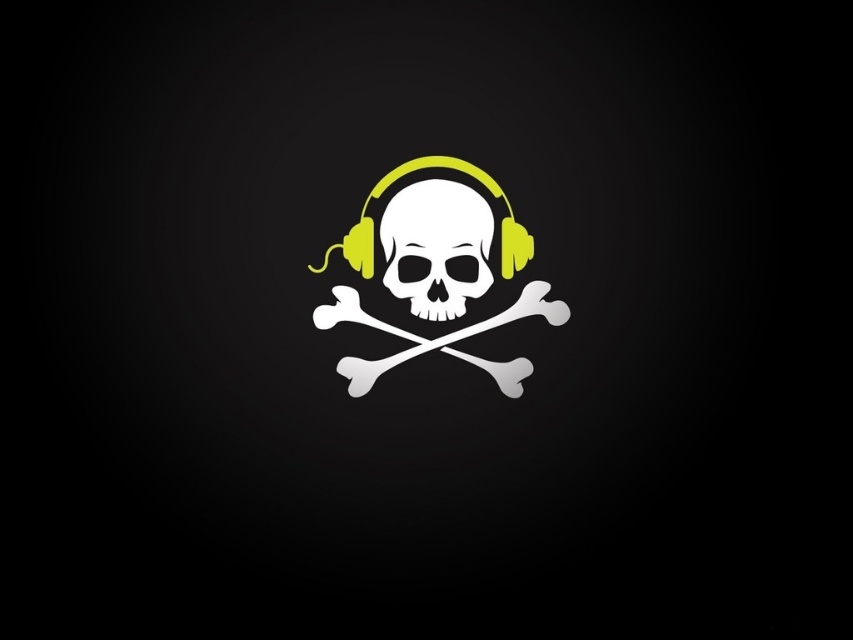
You are an artist working on a minimalist design featuring a skull and crossbones. You need to place a small sticker exactly at the coordinates point (436, 237). According to the image, where will this sticker be placed?

The point (436, 237) is on the white matte skull and crossbones at center, so the sticker will be placed there.